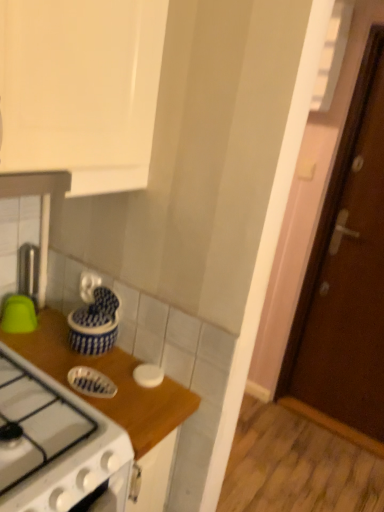
Where is `vacant space that is in between blue glossy dish at center, the 3th kitchen appliance from the left, and blue glossy jar at center, which is counted as the second kitchen appliance, starting from the left`? Image resolution: width=384 pixels, height=512 pixels. vacant space that is in between blue glossy dish at center, the 3th kitchen appliance from the left, and blue glossy jar at center, which is counted as the second kitchen appliance, starting from the left is located at coordinates (98, 366).